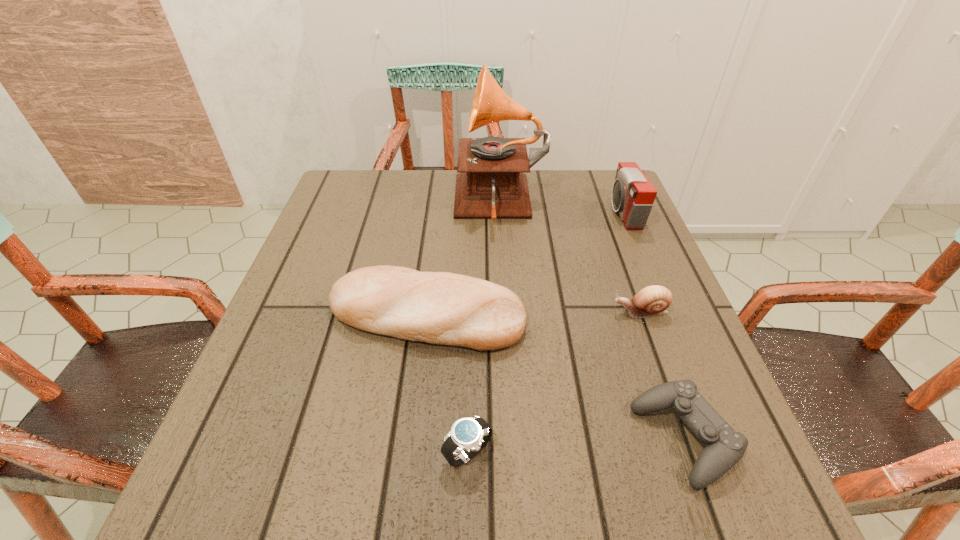
In order to click on phonograph record in this screenshot , I will do `click(491, 184)`.

At what (x,y) coordinates should I click in order to perform the action: click on the fifth shortest object. Please return your answer as a coordinate pair (x, y). This screenshot has width=960, height=540. Looking at the image, I should click on (633, 195).

This screenshot has width=960, height=540. What are the coordinates of `bread` in the screenshot? It's located at (445, 308).

Locate an element on the screen. This screenshot has height=540, width=960. watch is located at coordinates (468, 436).

Where is `escargot`? The image size is (960, 540). escargot is located at coordinates (651, 301).

Find the location of a particular element. The height and width of the screenshot is (540, 960). control is located at coordinates (724, 447).

Where is `free space located 0.260m on the horn of the tallest object`? The width and height of the screenshot is (960, 540). free space located 0.260m on the horn of the tallest object is located at coordinates (356, 205).

Image resolution: width=960 pixels, height=540 pixels. In order to click on vacant space located on the horn of the tallest object in this screenshot , I will do `click(409, 205)`.

Locate an element on the screen. free point located 0.300m on the horn of the tallest object is located at coordinates (342, 205).

Where is `vacant space located on the front-facing side of the fifth shortest object`? vacant space located on the front-facing side of the fifth shortest object is located at coordinates (492, 212).